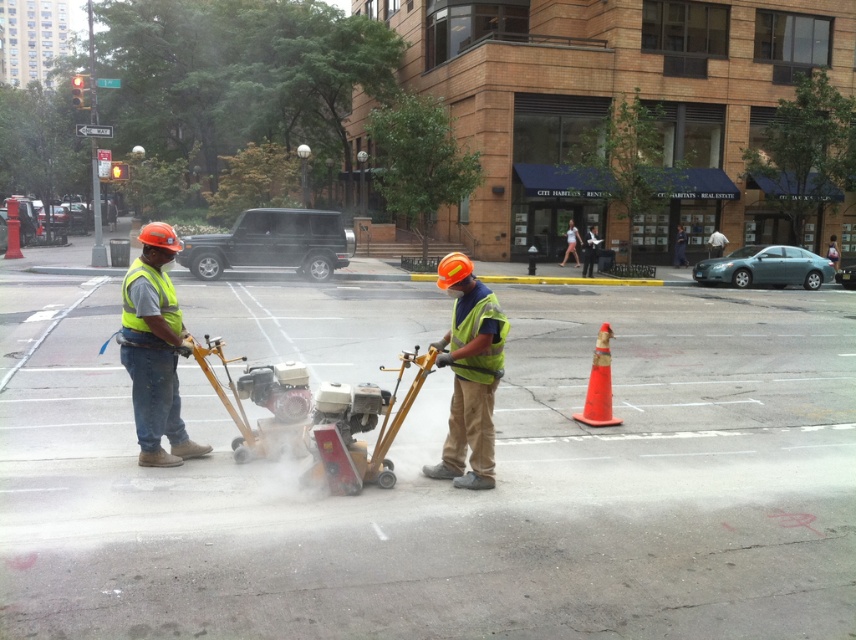
Is point (168, 284) behind point (596, 426)?

No, it is not.

The height and width of the screenshot is (640, 856). Find the location of `high-visibility yellow-green safety vest at left`. high-visibility yellow-green safety vest at left is located at coordinates (156, 296).

Is reflective yellow vest at left thinner than yellow reflective safety vest at center?

Yes, reflective yellow vest at left is thinner than yellow reflective safety vest at center.

Does reflective yellow vest at left have a smaller size compared to yellow reflective safety vest at center?

Yes, reflective yellow vest at left is smaller than yellow reflective safety vest at center.

Which is behind, point (119, 352) or point (486, 288)?

Positioned behind is point (486, 288).

Locate an element on the screen. This screenshot has width=856, height=640. reflective yellow vest at left is located at coordinates (153, 349).

Image resolution: width=856 pixels, height=640 pixels. What do you see at coordinates (470, 317) in the screenshot? I see `reflective yellow vest at center` at bounding box center [470, 317].

Which is above, reflective yellow vest at center or orange matte traffic cone at center-right?

Positioned higher is reflective yellow vest at center.

What are the coordinates of `reflective yellow vest at center` in the screenshot? It's located at (470, 317).